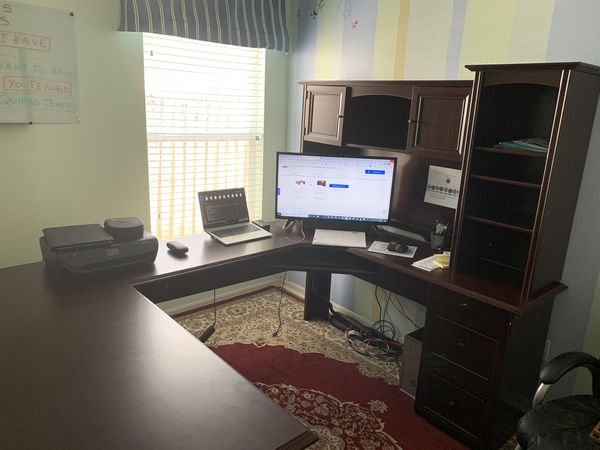
The width and height of the screenshot is (600, 450). Find the location of `computer power cord`. computer power cord is located at coordinates (206, 332).